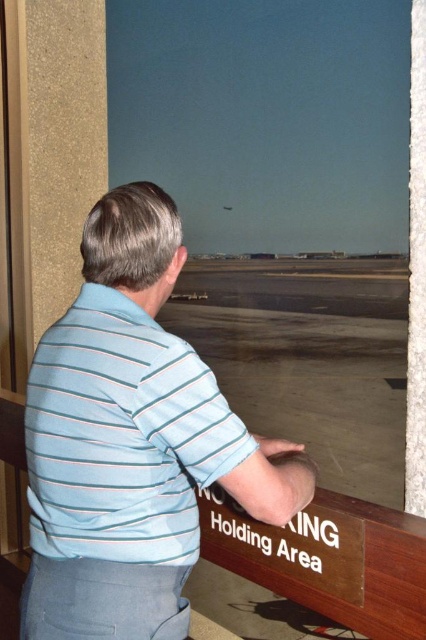
Can you confirm if light blue striped shirt at center is wider than light blue striped polo shirt at center?

Indeed, light blue striped shirt at center has a greater width compared to light blue striped polo shirt at center.

Does light blue striped shirt at center appear on the left side of light blue striped polo shirt at center?

Incorrect, light blue striped shirt at center is not on the left side of light blue striped polo shirt at center.

Is point (296, 490) more distant than point (94, 429)?

Yes, it is behind point (94, 429).

The height and width of the screenshot is (640, 426). Identify the location of light blue striped shirt at center. (131, 442).

Looking at this image, who is shorter, light blue striped polo shirt at center or smooth concrete tarmac at center?

light blue striped polo shirt at center

Is light blue striped polo shirt at center thinner than smooth concrete tarmac at center?

Yes, light blue striped polo shirt at center is thinner than smooth concrete tarmac at center.

Is point (172, 413) farther from camera compared to point (287, 403)?

No, it is in front of (287, 403).

Identify the location of light blue striped polo shirt at center. (121, 435).

Can you confirm if light blue striped shirt at center is taller than smooth concrete tarmac at center?

No.

Looking at this image, which of these two, light blue striped shirt at center or smooth concrete tarmac at center, stands taller?

smooth concrete tarmac at center

Which is behind, point (184, 541) or point (316, 417)?

The point (316, 417) is behind.

Find the location of a particular element. This screenshot has height=640, width=426. light blue striped shirt at center is located at coordinates (131, 442).